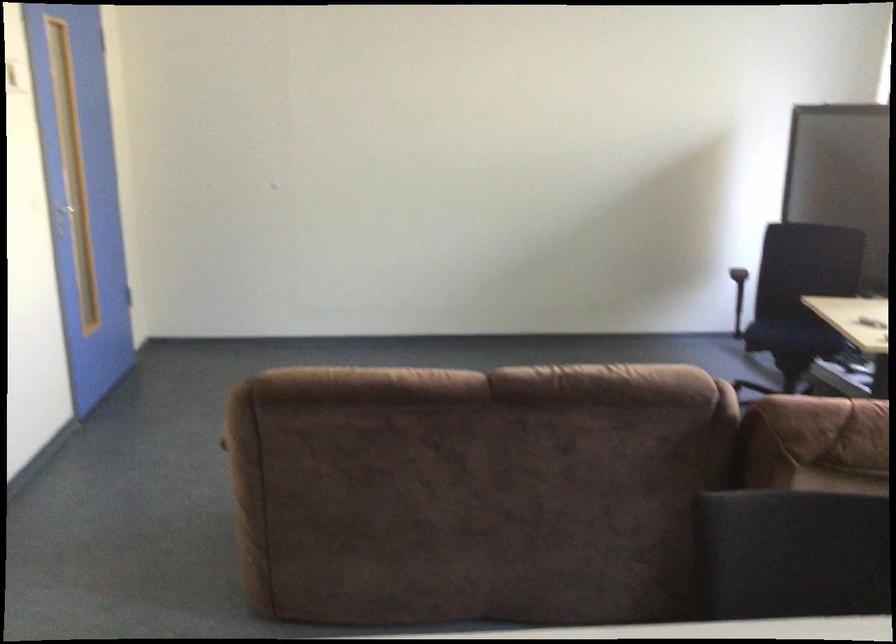
Find where to rest the brown sofa armrest. Please return your answer as a coordinate pair (x, y).

(487, 386)